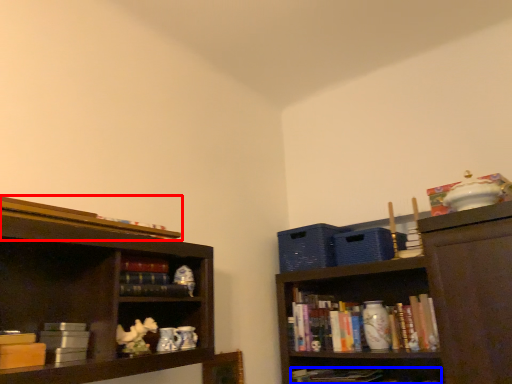
Question: Which point is closer to the camera, book (highlighted by a red box) or book (highlighted by a blue box)?

Choices:
 (A) book
 (B) book

Answer: (A)